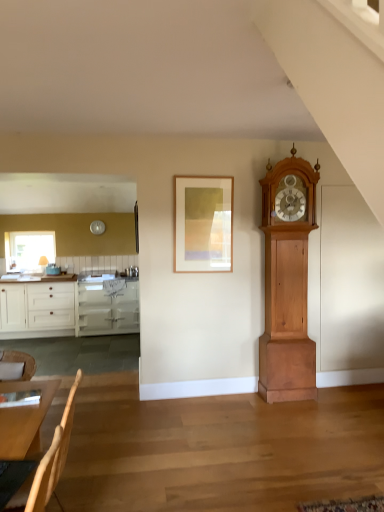
At what (x,y) coordinates should I click in order to perform the action: click on vacant space in front of light brown wooden grandfather clock at right. Please return your answer as a coordinate pair (x, y). The height and width of the screenshot is (512, 384). Looking at the image, I should click on (306, 409).